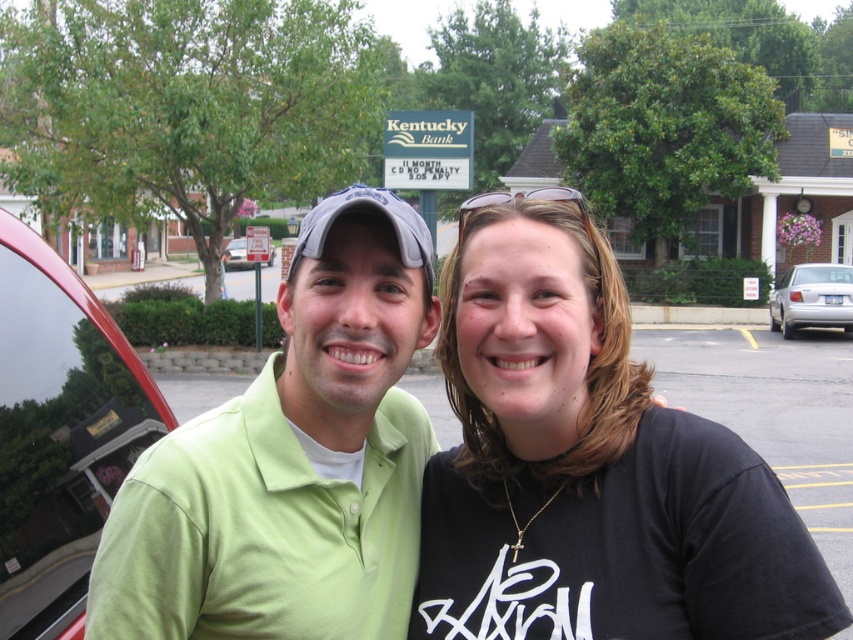
You are a photographer trying to capture a photo of the two people in front of the Kentucky Bank sign. The silver metallic sedan at right and the metallic silver car at left are blocking the view. Which car should you move to get a clear shot of the bank sign?

The silver metallic sedan at right is below metallic silver car at left, so moving the silver metallic sedan at right would allow you to see the Kentucky Bank sign more clearly.

You are taking a photo of the two people in the scene. The camera has a focus point at point A located at point A at point (355, 292) and another focus point at point B at point (32, 620). Which focus point should you use to ensure the person closer to the camera is in focus?

You should use the focus point at point A at point (355, 292) because it is in front of point B at point (32, 620), meaning the person closer to the camera is at point A.

You are a photographer trying to capture a closeup of the two people in the image. You want to focus on the point that is closer to the viewer. Which coordinate point should you choose between point [798,284] and point [223,264]?

Point [798,284] is closer to the viewer than point [223,264], so you should choose point [798,284] to focus on for the closeup.